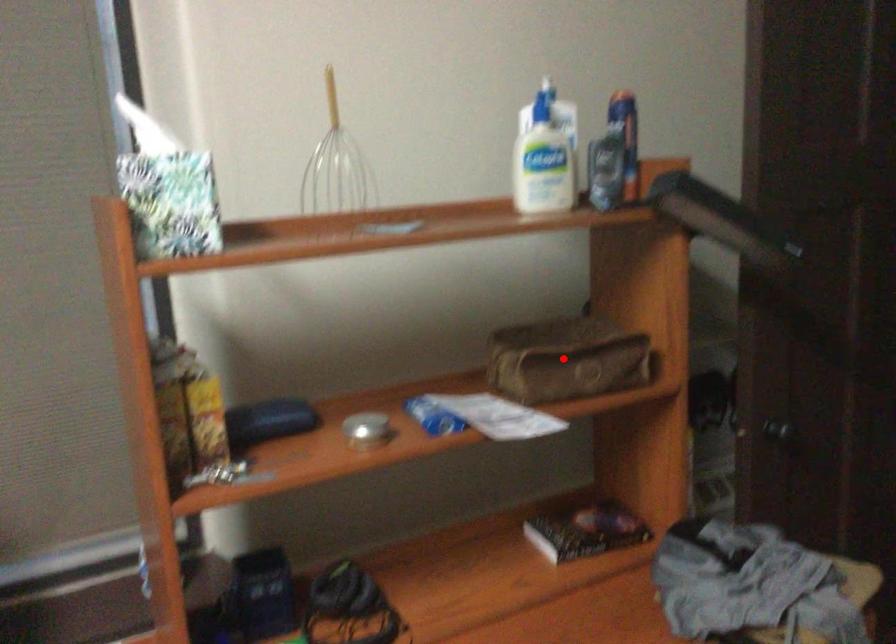
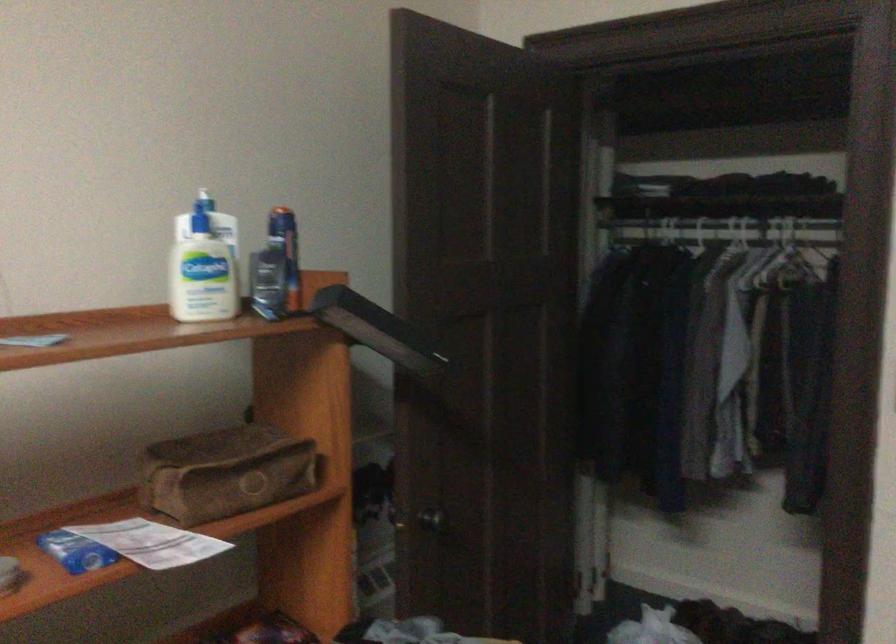
The point at the highlighted location is marked in the first image. Where is the corresponding point in the second image?

(226, 471)